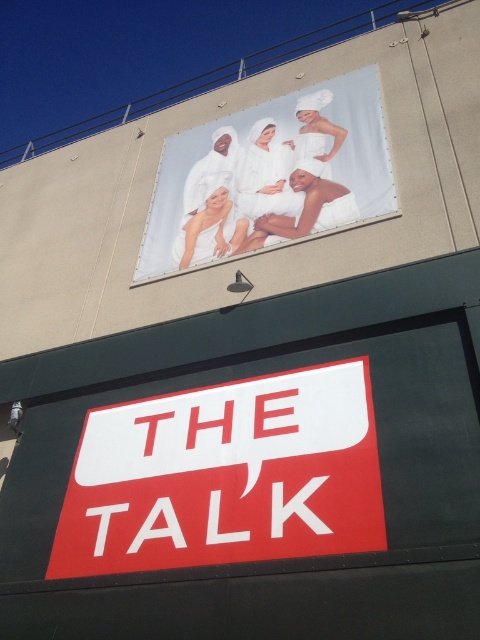
Question: Is white matte sign at center smaller than white towel at upper center?

Choices:
 (A) yes
 (B) no

Answer: (A)

Question: Which object appears farthest from the camera in this image?

Choices:
 (A) white matte sign at center
 (B) white towel at upper center

Answer: (B)

Question: Is white matte sign at center above white towel at upper center?

Choices:
 (A) no
 (B) yes

Answer: (A)

Question: Is white matte sign at center closer to the viewer compared to white towel at upper center?

Choices:
 (A) no
 (B) yes

Answer: (B)

Question: Which object is farther from the camera taking this photo?

Choices:
 (A) white towel at upper center
 (B) white matte sign at center

Answer: (A)